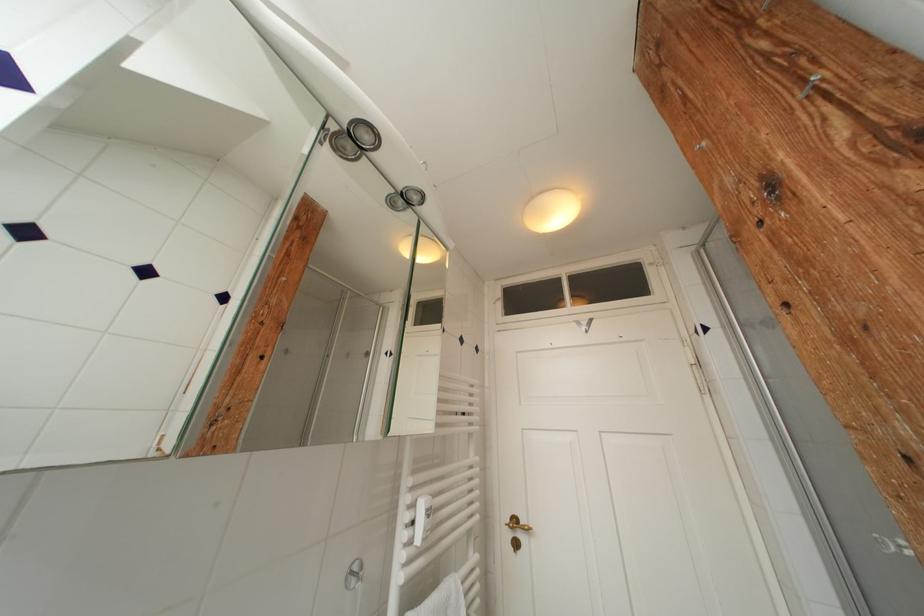
The height and width of the screenshot is (616, 924). What are the coordinates of `white control knob` in the screenshot? It's located at (354, 573).